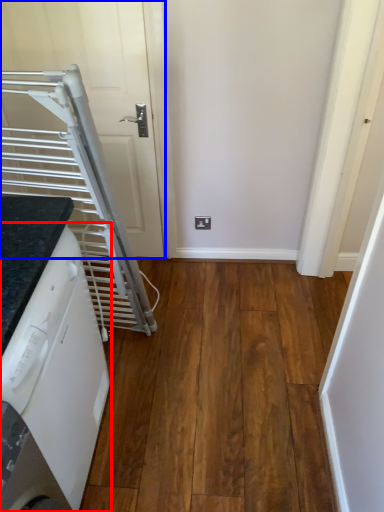
Question: Which object is closer to the camera taking this photo, home appliance (highlighted by a red box) or door (highlighted by a blue box)?

Choices:
 (A) home appliance
 (B) door

Answer: (A)